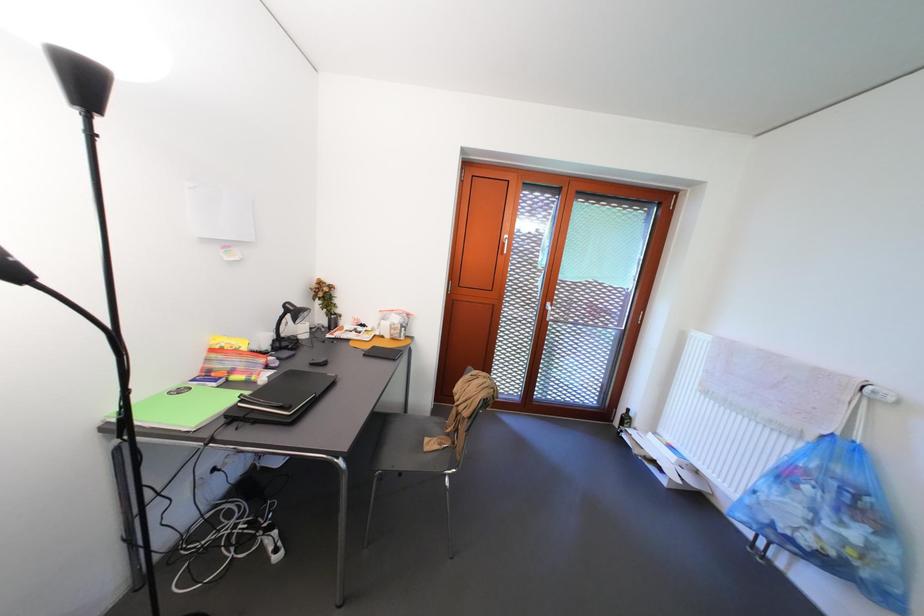
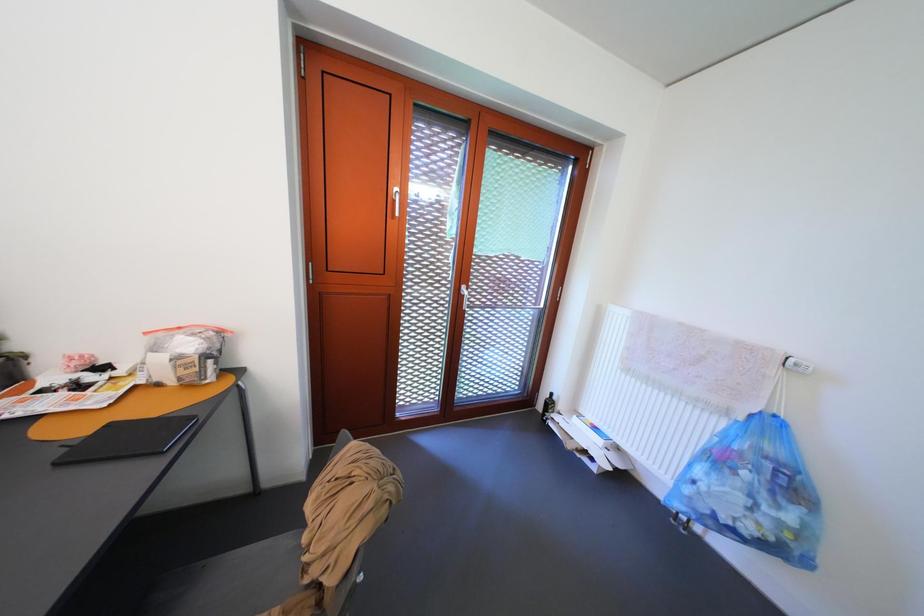
Question: How did the camera likely rotate?

Choices:
 (A) Left
 (B) Right
 (C) Up
 (D) Down

Answer: (B)